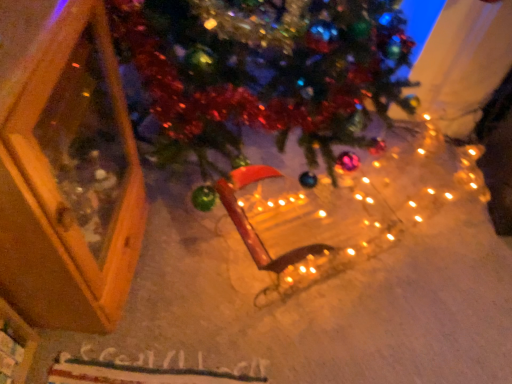
Question: Considering the relative sizes of wooden frame at left and wooden sled at center in the image provided, is wooden frame at left shorter than wooden sled at center?

Choices:
 (A) no
 (B) yes

Answer: (A)

Question: Does wooden frame at left have a lesser width compared to wooden sled at center?

Choices:
 (A) no
 (B) yes

Answer: (A)

Question: Is wooden frame at left smaller than wooden sled at center?

Choices:
 (A) no
 (B) yes

Answer: (A)

Question: Is wooden frame at left facing away from wooden sled at center?

Choices:
 (A) yes
 (B) no

Answer: (B)

Question: Is the depth of wooden frame at left greater than that of wooden sled at center?

Choices:
 (A) no
 (B) yes

Answer: (A)

Question: Does wooden frame at left turn towards wooden sled at center?

Choices:
 (A) yes
 (B) no

Answer: (A)

Question: From a real-world perspective, is wooden sled at center beneath wooden frame at left?

Choices:
 (A) yes
 (B) no

Answer: (A)

Question: Is wooden sled at center outside of wooden frame at left?

Choices:
 (A) yes
 (B) no

Answer: (A)

Question: From the image's perspective, is wooden sled at center beneath wooden frame at left?

Choices:
 (A) no
 (B) yes

Answer: (B)

Question: Is the depth of wooden sled at center greater than that of wooden frame at left?

Choices:
 (A) yes
 (B) no

Answer: (A)

Question: From a real-world perspective, is wooden sled at center on wooden frame at left?

Choices:
 (A) no
 (B) yes

Answer: (A)

Question: Could you tell me if wooden sled at center is facing wooden frame at left?

Choices:
 (A) yes
 (B) no

Answer: (B)

Question: From the image's perspective, relative to wooden frame at left, is wooden sled at center above or below?

Choices:
 (A) above
 (B) below

Answer: (B)